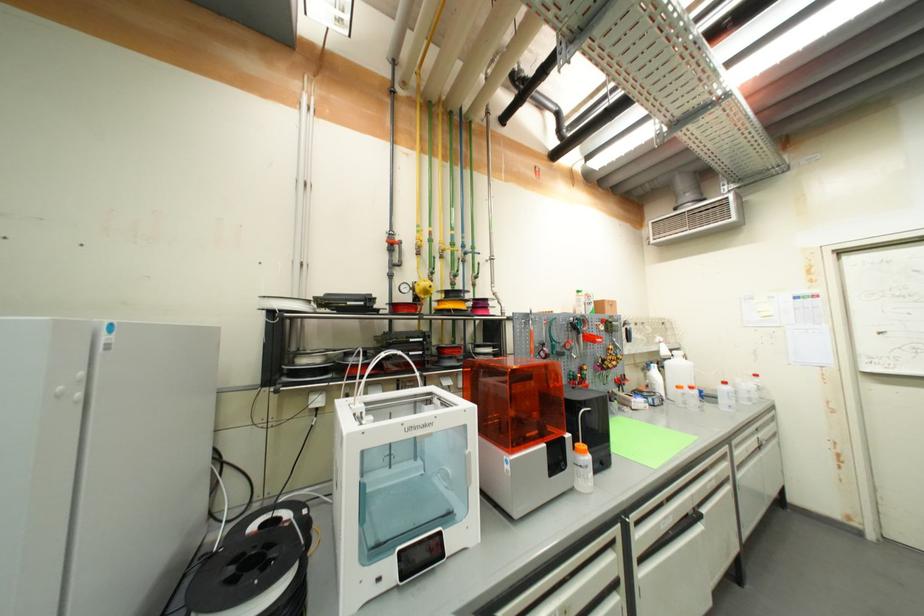
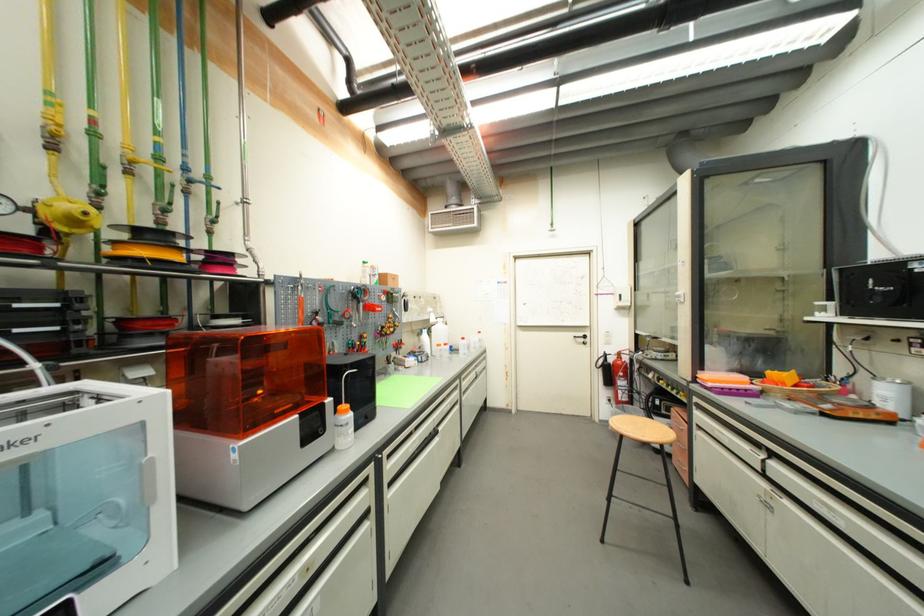
Find the pixel in the second image that matches (x=432, y=293) in the first image.

(82, 224)